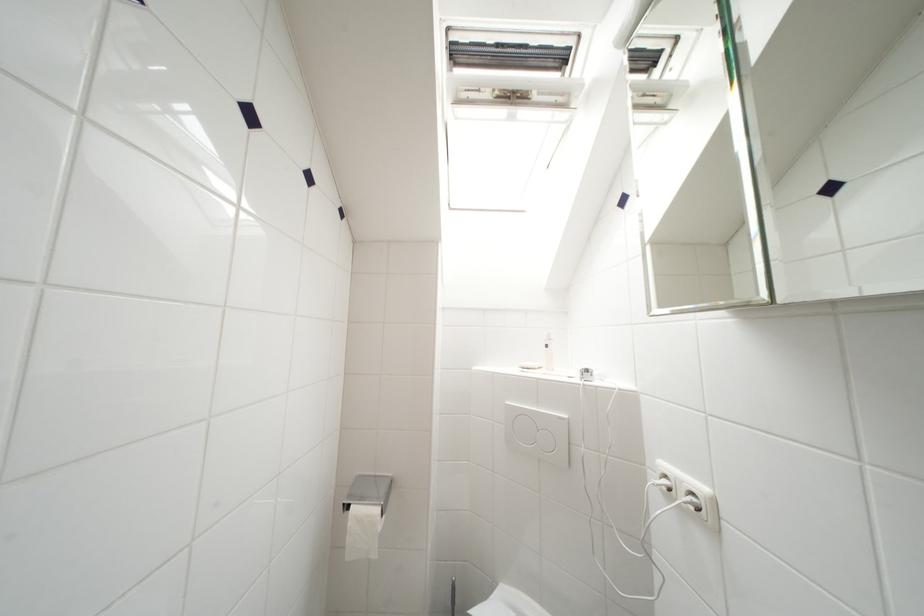
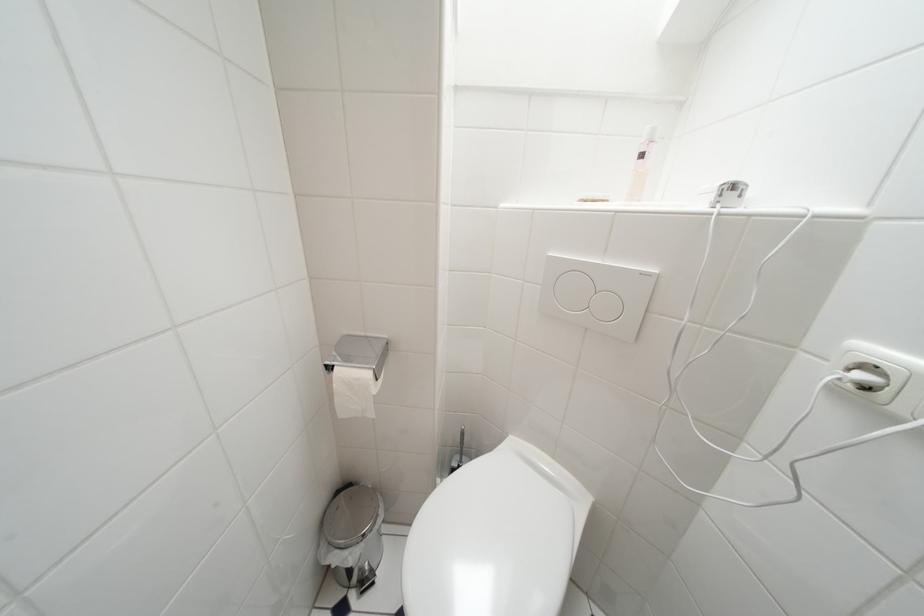
Question: Which direction would the cameraman need to move to produce the second image? Reply with the corresponding letter.

Choices:
 (A) Left
 (B) Right
 (C) Forward
 (D) Backward

Answer: (C)